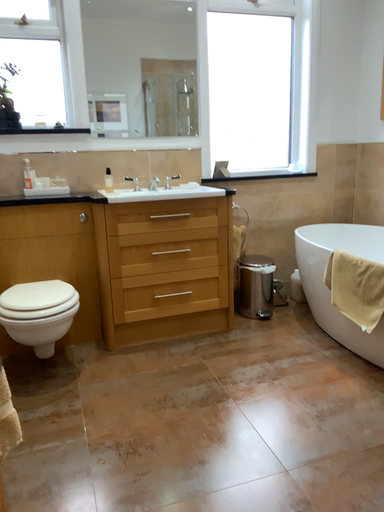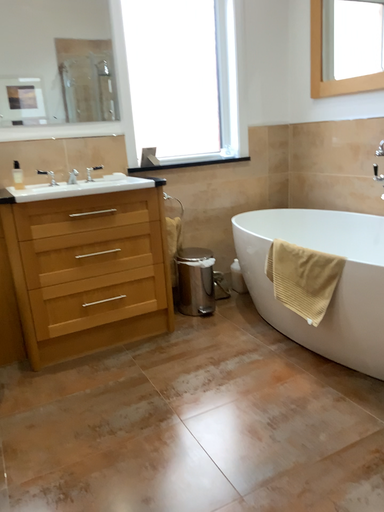
Question: How did the camera likely rotate when shooting the video?

Choices:
 (A) rotated right
 (B) rotated left

Answer: (A)